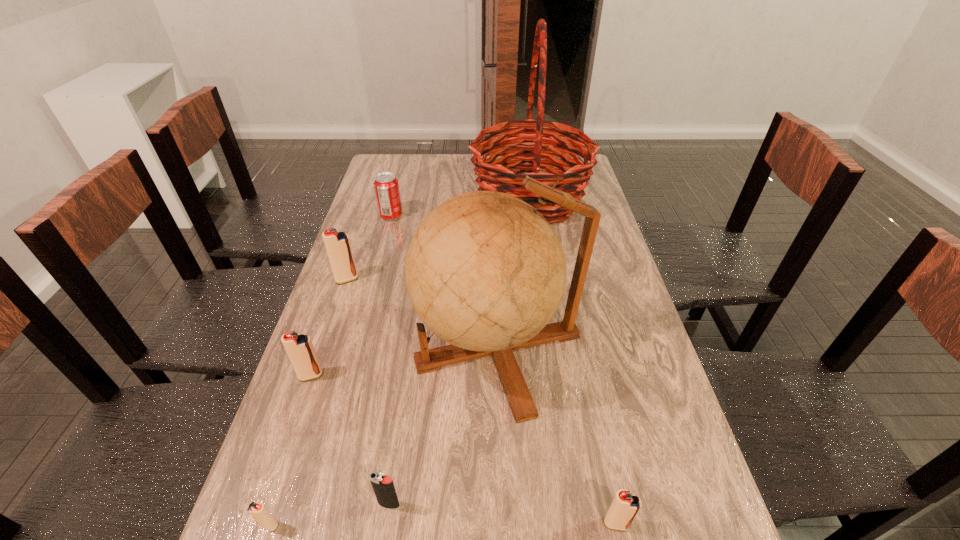
At what (x,y) coordinates should I click in order to perform the action: click on the third biggest red igniter. Please return your answer as a coordinate pair (x, y). Image resolution: width=960 pixels, height=540 pixels. Looking at the image, I should click on (625, 506).

You are a GUI agent. You are given a task and a screenshot of the screen. Output one action in this format:
    pyautogui.click(x=<x>, y=<y>)
    Task: Click on the shortest igniter
    
    Given the screenshot: What is the action you would take?
    pyautogui.click(x=257, y=510)

You are a GUI agent. You are given a task and a screenshot of the screen. Output one action in this format:
    pyautogui.click(x=<x>, y=<y>)
    Task: Click on the smallest red igniter
    This screenshot has height=540, width=960.
    Given the screenshot: What is the action you would take?
    pyautogui.click(x=257, y=510)

Where is `blank space located on the left of the tallest object`? blank space located on the left of the tallest object is located at coordinates (447, 198).

The image size is (960, 540). Find the location of `vacant point located on the surface of the globe`. vacant point located on the surface of the globe is located at coordinates (308, 348).

Find the location of a particular element. The image size is (960, 540). vacant space situated 0.200m on the surface of the globe is located at coordinates (336, 348).

This screenshot has height=540, width=960. I want to click on free space located on the surface of the globe, so click(x=379, y=348).

The image size is (960, 540). What are the coordinates of `vacant region located on the front of the sixth shortest object` in the screenshot? It's located at (337, 310).

I want to click on blank space located on the front of the soda, so click(380, 258).

Image resolution: width=960 pixels, height=540 pixels. In order to click on vacant space located 0.190m on the right of the fourth nearest igniter in this screenshot , I will do pyautogui.click(x=402, y=375).